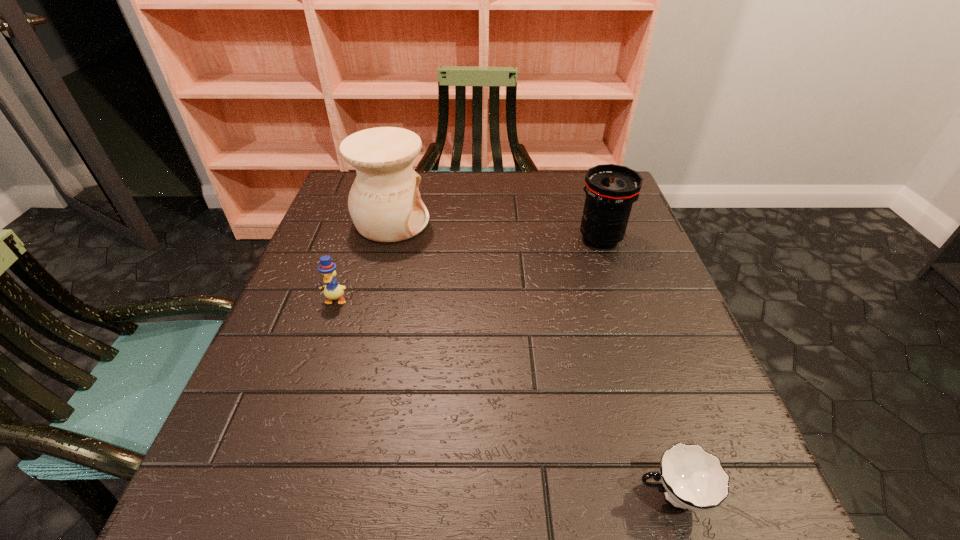
The width and height of the screenshot is (960, 540). In the image, there is a desktop. What are the coordinates of `vacant space at the far edge` in the screenshot? It's located at (487, 181).

I want to click on vacant space at the near edge of the desktop, so click(x=335, y=523).

In the image, there is a desktop. Identify the location of vacant space at the right edge. This screenshot has width=960, height=540. (728, 441).

Where is `blank space at the near left corner of the desktop`? The image size is (960, 540). blank space at the near left corner of the desktop is located at coordinates (225, 490).

Image resolution: width=960 pixels, height=540 pixels. Find the location of `free space between the cup and the pottery`. free space between the cup and the pottery is located at coordinates (532, 359).

Find the location of a particular element. The height and width of the screenshot is (540, 960). vacant region between the tallest object and the duckling is located at coordinates (364, 261).

Find the location of `empty space between the pottery and the nearest object`. empty space between the pottery and the nearest object is located at coordinates (532, 359).

Locate an element on the screen. Image resolution: width=960 pixels, height=540 pixels. free space between the cup and the pottery is located at coordinates (532, 359).

Identify the location of vacant area that lies between the second tallest object and the tallest object. This screenshot has height=540, width=960. (496, 231).

Where is `blank region between the second shortest object and the shortest object`? blank region between the second shortest object and the shortest object is located at coordinates (504, 397).